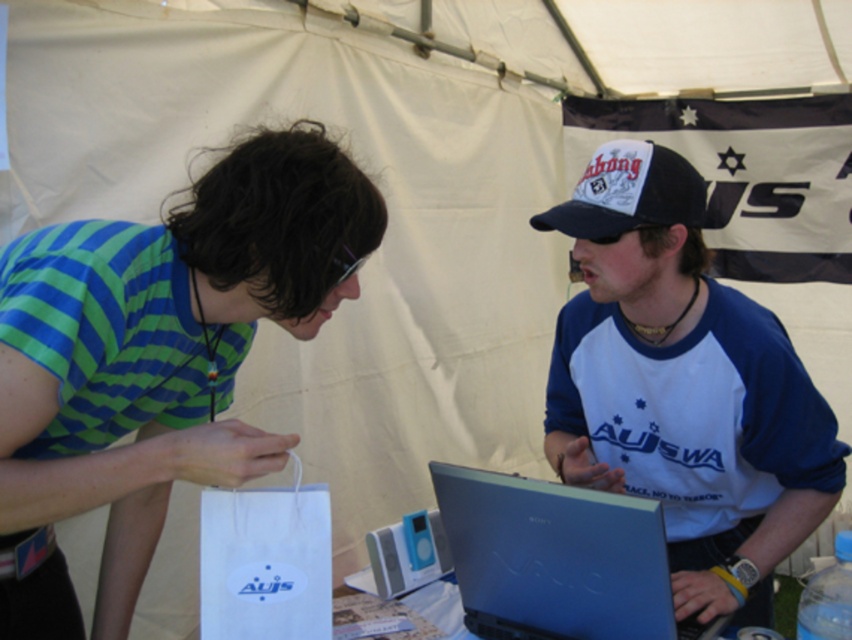
You are standing at the location of the viewer. There is a point at coordinates point (444, 506). If you want to place a small gift at that point, will you be able to reach it without moving your feet?

The point at coordinates point (444, 506) is 4.70 feet away from you, so you cannot reach it without moving your feet since the distance is greater than an average person can reach.

You are a delivery person who needs to place a 25 cm long package between the matte blue laptop at center and the black fabric baseball cap at upper right. Can the package fit in the space between them?

The distance between the matte blue laptop at center and the black fabric baseball cap at upper right is 25.13 centimeters, so the 25 cm long package can fit in the space between them since it is slightly shorter than the available distance.

You are a photographer at the event and need to capture a photo of both the sleek blue laptop at center and the black fabric baseball cap at upper right. Based on their positions, which object should you focus on first to ensure both are in frame without moving the camera?

The sleek blue laptop at center is to the left of the black fabric baseball cap at upper right, so you should focus on the black fabric baseball cap at upper right first. This way, since the laptop is to the left, adjusting the camera to include the cap on the right ensures both are within the frame without needing to reposition the camera.